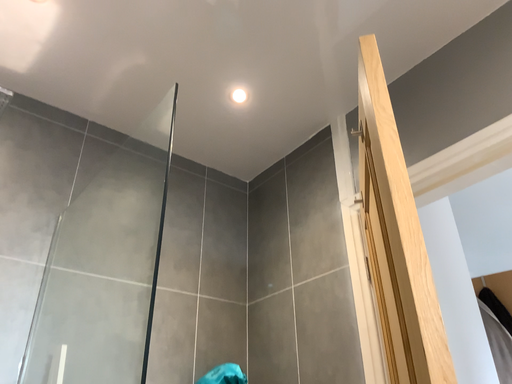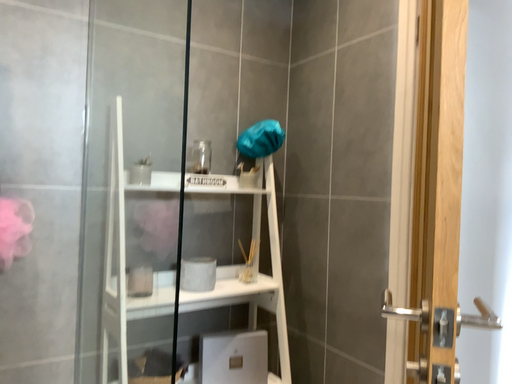
Question: How did the camera likely rotate when shooting the video?

Choices:
 (A) rotated right
 (B) rotated left

Answer: (B)